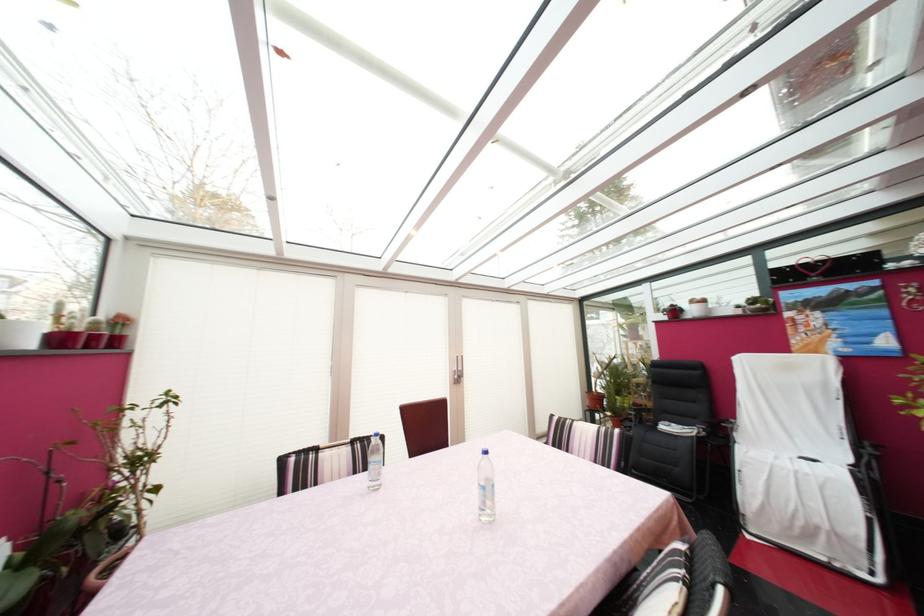
Describe the element at coordinates (457, 370) in the screenshot. I see `the silver door handle` at that location.